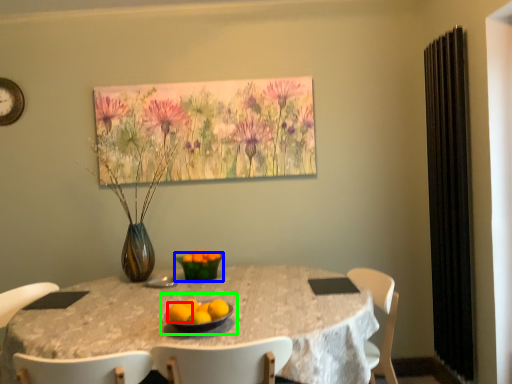
Question: Which is nearer to the orange (highlighted by a red box)? glass bowl (highlighted by a blue box) or fruit dish (highlighted by a green box).

Choices:
 (A) glass bowl
 (B) fruit dish

Answer: (B)